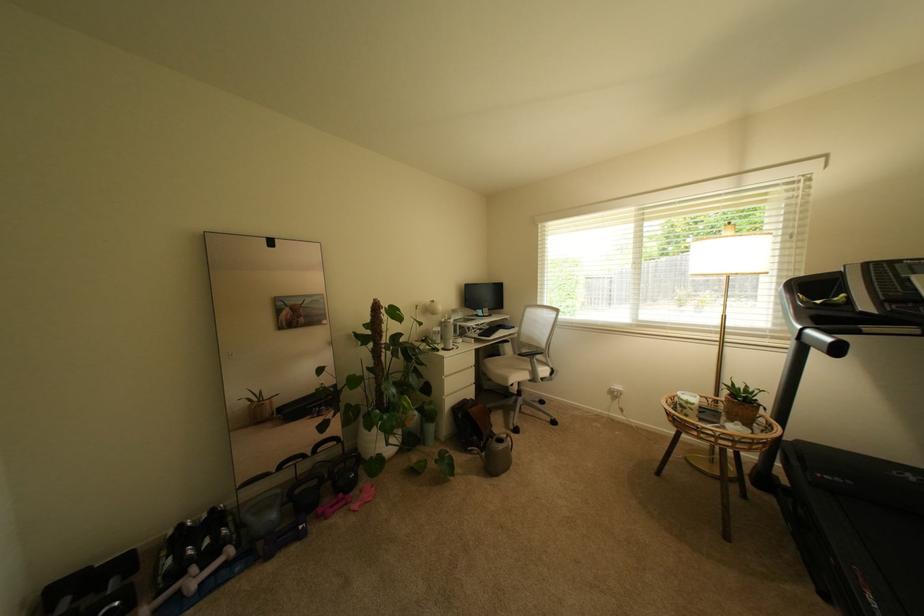
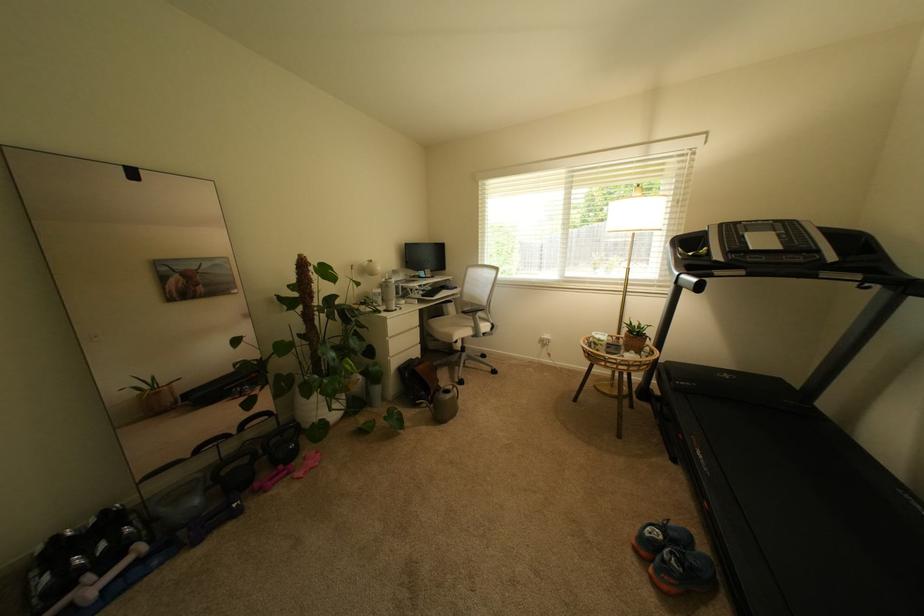
Where in the second image is the point corresponding to the point at 523,355 from the first image?

(466, 314)